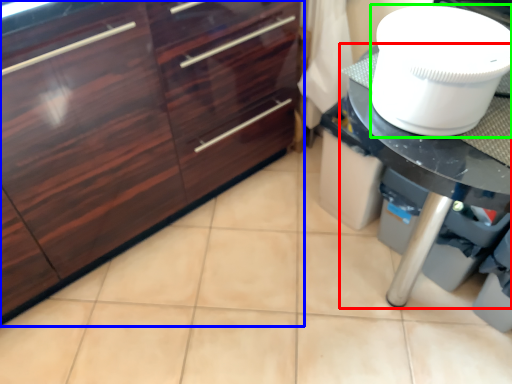
Question: Estimate the real-world distances between objects in this image. Which object is farther from countertop (highlighted by a red box), cabinetry (highlighted by a blue box) or toilet bowl (highlighted by a green box)?

Choices:
 (A) cabinetry
 (B) toilet bowl

Answer: (A)